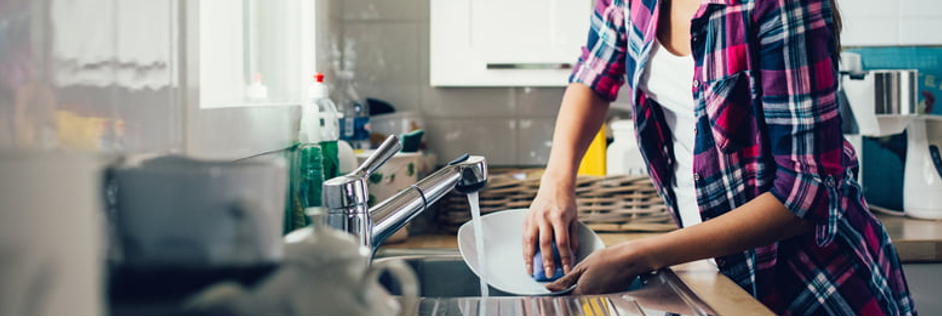
Where is `dishwashing liquid nozzle`? dishwashing liquid nozzle is located at coordinates [317, 76].